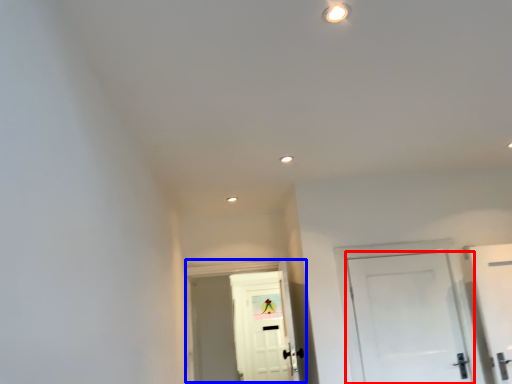
Question: Which object is further to the camera taking this photo, door (highlighted by a red box) or door (highlighted by a blue box)?

Choices:
 (A) door
 (B) door

Answer: (B)